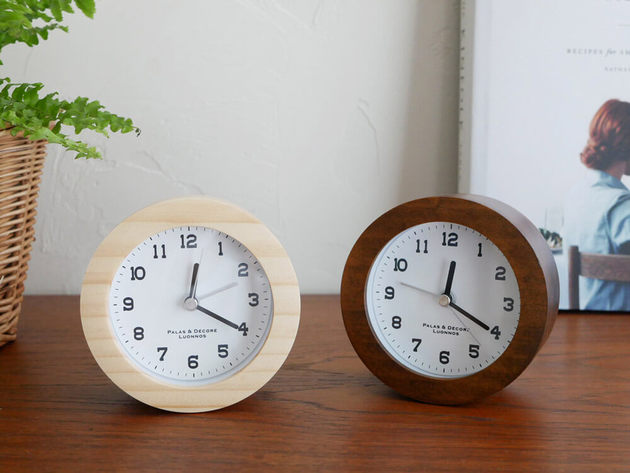
The height and width of the screenshot is (473, 630). What are the coordinates of `minute hand on clock` in the screenshot? It's located at (217, 318), (467, 313).